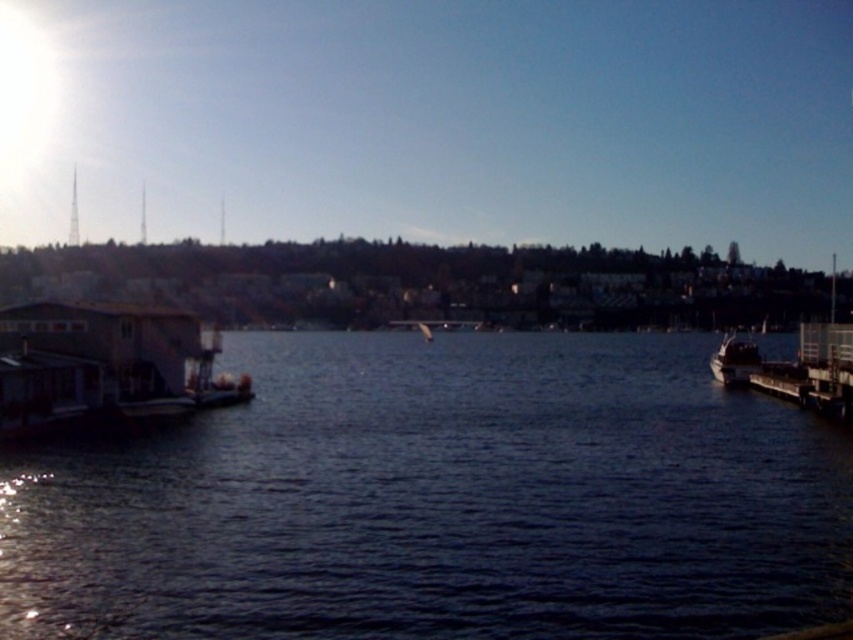
Which is above, dark blue water at center or shiny silver boat at right?

shiny silver boat at right is higher up.

Between dark blue water at center and shiny silver boat at right, which one has more height?

shiny silver boat at right is taller.

The image size is (853, 640). What are the coordinates of `dark blue water at center` in the screenshot? It's located at (440, 500).